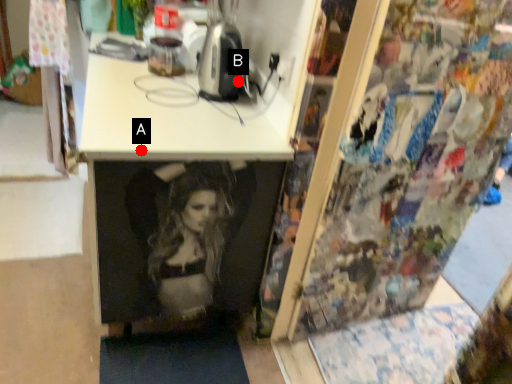
Question: Two points are circled on the image, labeled by A and B beside each circle. Which point is closer to the camera?

Choices:
 (A) A is closer
 (B) B is closer

Answer: (A)